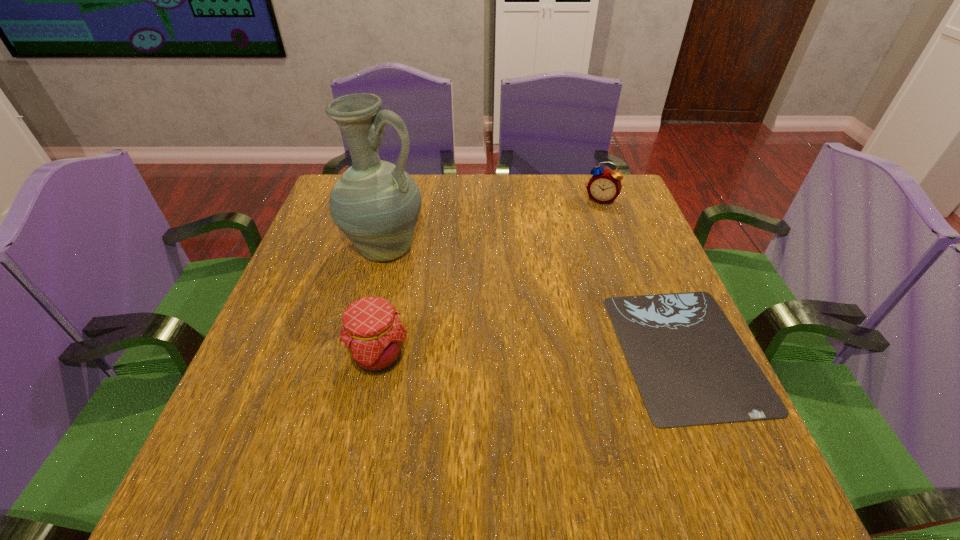
I want to click on vacant space that's between the mousepad and the alarm clock, so click(643, 275).

At what (x,y) coordinates should I click in order to perform the action: click on free spot between the jam and the farthest object. Please return your answer as a coordinate pair (x, y). The height and width of the screenshot is (540, 960). Looking at the image, I should click on (490, 279).

This screenshot has width=960, height=540. Identify the location of vacant space that is in between the shortest object and the alarm clock. (643, 275).

Locate an element on the screen. vacant area that lies between the jam and the shortest object is located at coordinates (532, 354).

Where is `the second closest object to the mousepad`? This screenshot has height=540, width=960. the second closest object to the mousepad is located at coordinates (374, 337).

At what (x,y) coordinates should I click in order to perform the action: click on object that is the second nearest to the jam. Please return your answer as a coordinate pair (x, y). Looking at the image, I should click on (691, 368).

The image size is (960, 540). Identify the location of free location that satisfies the following two spatial constraints: 1. on the back side of the alarm clock; 2. on the right side of the third nearest object. (397, 200).

Identify the location of vacant space that satisfies the following two spatial constraints: 1. on the back side of the jam; 2. on the left side of the mousepad. (380, 351).